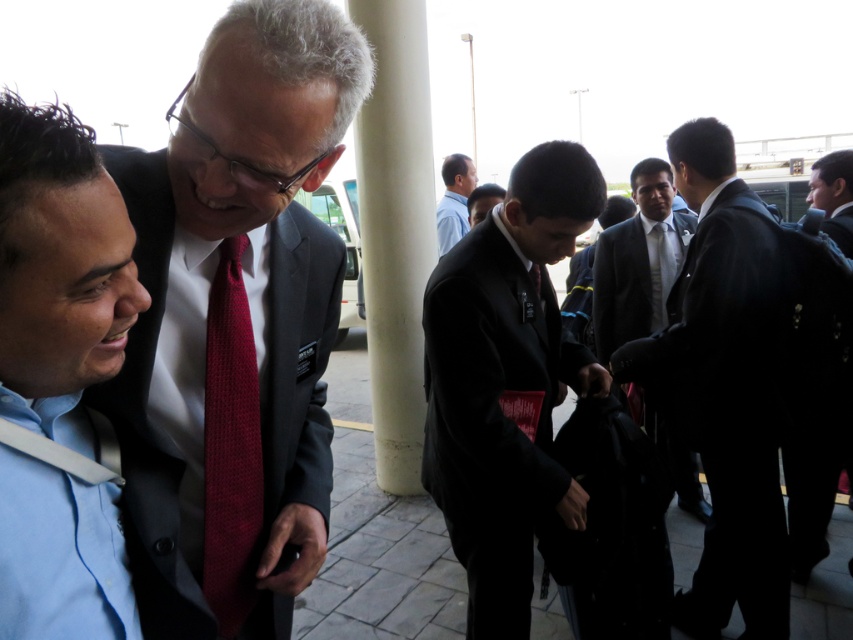
You are a photographer standing in the scene and want to take a photo of both the black matte suit at center and the dark gray suit at center. Which one should you focus on first to ensure it appears larger in the photo?

The black matte suit at center is taller than the dark gray suit at center, so focusing on the black matte suit at center first will ensure it appears larger in the photo.

You are standing at the camera position and want to reach point (18, 636). Can you walk directly to it without needing to move any objects?

The distance between point (18, 636) and the camera is 26.00 inches, so yes, you can walk directly to it since there are no objects mentioned blocking the path.

You are standing at the point with coordinates point at (59, 273). What object are you touching?

The point at (59, 273) is on the light blue shirt at left, so you are touching the light blue shirt at left.